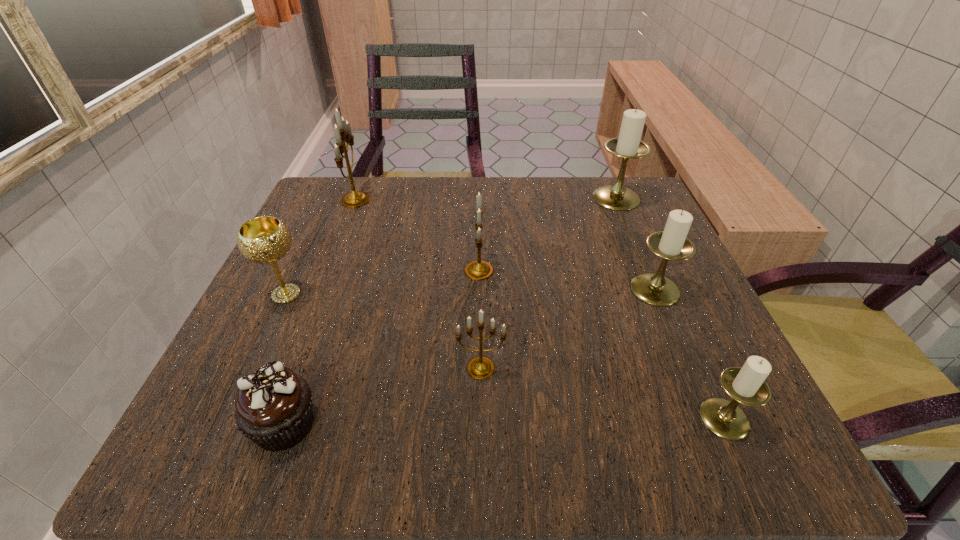
Select which white candle holder is the second closest to the second smallest gold candelabrum. Please provide its 2D coordinates. Your answer should be formatted as a tuple, i.e. [(x, y)], where the tuple contains the x and y coordinates of a point satisfying the conditions above.

[(628, 145)]

Locate which white candle holder ranks in proximity to the second farthest gold candelabrum. Please provide its 2D coordinates. Your answer should be formatted as a tuple, i.e. [(x, y)], where the tuple contains the x and y coordinates of a point satisfying the conditions above.

[(671, 244)]

Identify which gold candelabrum is the third closest to the farthest white candle holder. Please provide its 2D coordinates. Your answer should be formatted as a tuple, i.e. [(x, y)], where the tuple contains the x and y coordinates of a point satisfying the conditions above.

[(342, 130)]

Locate which gold candelabrum is the third closest to the shortest object. Please provide its 2D coordinates. Your answer should be formatted as a tuple, i.e. [(x, y)], where the tuple contains the x and y coordinates of a point satisfying the conditions above.

[(342, 130)]

You are a GUI agent. You are given a task and a screenshot of the screen. Output one action in this format:
    pyautogui.click(x=<x>, y=<y>)
    Task: Click on the vacant area that satisfies the following two spatial constraints: 1. on the back side of the chalice; 2. on the right side of the farthest white candle holder
    The image size is (960, 540).
    Given the screenshot: What is the action you would take?
    pyautogui.click(x=331, y=198)

The image size is (960, 540). I want to click on free space that satisfies the following two spatial constraints: 1. on the back side of the farthest white candle holder; 2. on the left side of the leftmost gold candelabrum, so click(356, 198).

Where is `free region that satisfies the following two spatial constraints: 1. on the front side of the smallest white candle holder; 2. on the right side of the nearest gold candelabrum`? free region that satisfies the following two spatial constraints: 1. on the front side of the smallest white candle holder; 2. on the right side of the nearest gold candelabrum is located at coordinates (481, 418).

The height and width of the screenshot is (540, 960). In order to click on free location that satisfies the following two spatial constraints: 1. on the back side of the biggest white candle holder; 2. on the right side of the second farthest white candle holder in this screenshot , I will do `click(616, 198)`.